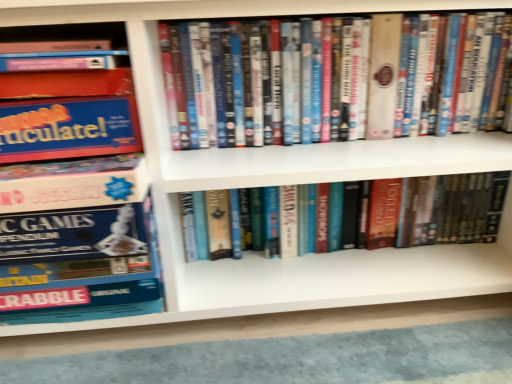
Locate an element on the screen. This screenshot has height=384, width=512. matte plastic dvds at center, placed as the 2th book when sorted from left to right is located at coordinates (335, 79).

Identify the location of blue cardboard game box at left, the first book from the left. (75, 212).

Does hardcover book at center, the third book viewed from the left, have a lesser height compared to matte plastic dvds at center, marked as the second book in a right-to-left arrangement?

Correct, hardcover book at center, the third book viewed from the left, is not as tall as matte plastic dvds at center, marked as the second book in a right-to-left arrangement.

Is hardcover book at center, which is the first book in right-to-left order, bigger than matte plastic dvds at center, marked as the second book in a right-to-left arrangement?

Incorrect, hardcover book at center, which is the first book in right-to-left order, is not larger than matte plastic dvds at center, marked as the second book in a right-to-left arrangement.

Who is more distant, hardcover book at center, the third book viewed from the left, or matte plastic dvds at center, marked as the second book in a right-to-left arrangement?

hardcover book at center, the third book viewed from the left.

Identify the location of book that appears below the blue cardboard game box at left, the first book from the left (from the image's perspective). This screenshot has height=384, width=512. (449, 209).

Which of these two, blue cardboard game box at left, the first book from the left, or hardcover book at center, the third book viewed from the left, stands shorter?

Standing shorter between the two is hardcover book at center, the third book viewed from the left.

Would you say blue cardboard game box at left, which is counted as the third book, starting from the right, is to the left or to the right of hardcover book at center, which is the first book in right-to-left order, in the picture?

Based on their positions, blue cardboard game box at left, which is counted as the third book, starting from the right, is located to the left of hardcover book at center, which is the first book in right-to-left order.

From a real-world perspective, does blue cardboard game box at left, which is counted as the third book, starting from the right, sit lower than hardcover book at center, which is the first book in right-to-left order?

Actually, blue cardboard game box at left, which is counted as the third book, starting from the right, is physically above hardcover book at center, which is the first book in right-to-left order, in the real world.

Considering the relative sizes of matte plastic dvds at center, placed as the 2th book when sorted from left to right, and hardcover book at center, which is the first book in right-to-left order, in the image provided, is matte plastic dvds at center, placed as the 2th book when sorted from left to right, bigger than hardcover book at center, which is the first book in right-to-left order,?

Yes.

Between matte plastic dvds at center, placed as the 2th book when sorted from left to right, and hardcover book at center, the third book viewed from the left, which one has less height?

hardcover book at center, the third book viewed from the left.

From a real-world perspective, is matte plastic dvds at center, marked as the second book in a right-to-left arrangement, beneath hardcover book at center, which is the first book in right-to-left order?

No, from a real-world perspective, matte plastic dvds at center, marked as the second book in a right-to-left arrangement, is not beneath hardcover book at center, which is the first book in right-to-left order.

Are matte plastic dvds at center, marked as the second book in a right-to-left arrangement, and hardcover book at center, the third book viewed from the left, located far from each other?

No, matte plastic dvds at center, marked as the second book in a right-to-left arrangement, is not far from hardcover book at center, the third book viewed from the left.

Is matte plastic dvds at center, placed as the 2th book when sorted from left to right, next to blue cardboard game box at left, which is counted as the third book, starting from the right, and touching it?

No, matte plastic dvds at center, placed as the 2th book when sorted from left to right, is not next to blue cardboard game box at left, which is counted as the third book, starting from the right.

Is matte plastic dvds at center, placed as the 2th book when sorted from left to right, oriented towards blue cardboard game box at left, the first book from the left?

No, matte plastic dvds at center, placed as the 2th book when sorted from left to right, is not aimed at blue cardboard game box at left, the first book from the left.

Looking at this image, which of these two, matte plastic dvds at center, marked as the second book in a right-to-left arrangement, or blue cardboard game box at left, which is counted as the third book, starting from the right, is bigger?

blue cardboard game box at left, which is counted as the third book, starting from the right, is bigger.

Based on the photo, from a real-world perspective, who is located lower, matte plastic dvds at center, marked as the second book in a right-to-left arrangement, or blue cardboard game box at left, which is counted as the third book, starting from the right?

blue cardboard game box at left, which is counted as the third book, starting from the right, is physically lower.

Is the depth of hardcover book at center, the third book viewed from the left, greater than that of blue cardboard game box at left, which is counted as the third book, starting from the right?

Yes, it is behind blue cardboard game box at left, which is counted as the third book, starting from the right.

From a real-world perspective, is hardcover book at center, which is the first book in right-to-left order, on blue cardboard game box at left, the first book from the left?

No, from a real-world perspective, hardcover book at center, which is the first book in right-to-left order, is not above blue cardboard game box at left, the first book from the left.

Looking at this image, is hardcover book at center, which is the first book in right-to-left order, taller or shorter than blue cardboard game box at left, the first book from the left?

Considering their sizes, hardcover book at center, which is the first book in right-to-left order, has less height than blue cardboard game box at left, the first book from the left.

Is hardcover book at center, which is the first book in right-to-left order, placed right next to blue cardboard game box at left, the first book from the left?

hardcover book at center, which is the first book in right-to-left order, is not next to blue cardboard game box at left, the first book from the left, and they're not touching.

Is blue cardboard game box at left, the first book from the left, facing away from matte plastic dvds at center, marked as the second book in a right-to-left arrangement?

No.

Considering the sizes of objects blue cardboard game box at left, which is counted as the third book, starting from the right, and matte plastic dvds at center, placed as the 2th book when sorted from left to right, in the image provided, who is smaller, blue cardboard game box at left, which is counted as the third book, starting from the right, or matte plastic dvds at center, placed as the 2th book when sorted from left to right,?

matte plastic dvds at center, placed as the 2th book when sorted from left to right, is smaller.

Between blue cardboard game box at left, which is counted as the third book, starting from the right, and matte plastic dvds at center, placed as the 2th book when sorted from left to right, which one has smaller width?

Thinner between the two is matte plastic dvds at center, placed as the 2th book when sorted from left to right.

Locate an element on the screen. The image size is (512, 384). book that is on the right side of matte plastic dvds at center, placed as the 2th book when sorted from left to right is located at coordinates (449, 209).

From the image's perspective, which book is the 1st one above the hardcover book at center, the third book viewed from the left? Please provide its 2D coordinates.

[(75, 212)]

From the image, which object appears to be nearer to matte plastic dvds at center, placed as the 2th book when sorted from left to right, blue cardboard game box at left, the first book from the left, or hardcover book at center, which is the first book in right-to-left order?

hardcover book at center, which is the first book in right-to-left order, is closer to matte plastic dvds at center, placed as the 2th book when sorted from left to right.

Based on the photo, which object lies nearer to the anchor point blue cardboard game box at left, which is counted as the third book, starting from the right, matte plastic dvds at center, placed as the 2th book when sorted from left to right, or hardcover book at center, which is the first book in right-to-left order?

Among the two, matte plastic dvds at center, placed as the 2th book when sorted from left to right, is located nearer to blue cardboard game box at left, which is counted as the third book, starting from the right.

Which object lies further to the anchor point blue cardboard game box at left, the first book from the left, hardcover book at center, which is the first book in right-to-left order, or matte plastic dvds at center, marked as the second book in a right-to-left arrangement?

hardcover book at center, which is the first book in right-to-left order, lies further to blue cardboard game box at left, the first book from the left, than the other object.

Estimate the real-world distances between objects in this image. Which object is closer to hardcover book at center, which is the first book in right-to-left order, matte plastic dvds at center, placed as the 2th book when sorted from left to right, or blue cardboard game box at left, the first book from the left?

The object closer to hardcover book at center, which is the first book in right-to-left order, is matte plastic dvds at center, placed as the 2th book when sorted from left to right.

Considering their positions, is hardcover book at center, the third book viewed from the left, positioned closer to matte plastic dvds at center, placed as the 2th book when sorted from left to right, than blue cardboard game box at left, which is counted as the third book, starting from the right?

Among the two, hardcover book at center, the third book viewed from the left, is located nearer to matte plastic dvds at center, placed as the 2th book when sorted from left to right.

Which object lies further to the anchor point hardcover book at center, the third book viewed from the left, blue cardboard game box at left, the first book from the left, or matte plastic dvds at center, placed as the 2th book when sorted from left to right?

Among the two, blue cardboard game box at left, the first book from the left, is located further to hardcover book at center, the third book viewed from the left.

Identify the location of book located between blue cardboard game box at left, which is counted as the third book, starting from the right, and hardcover book at center, the third book viewed from the left, in the left-right direction. (335, 79).